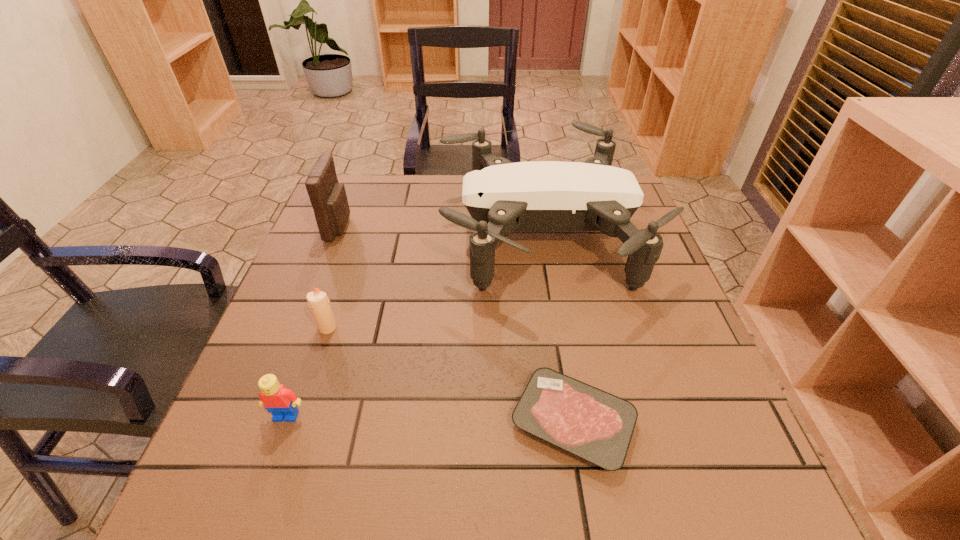
I want to click on vacant space located 0.100m on the face of the Lego, so click(x=263, y=481).

The height and width of the screenshot is (540, 960). What are the coordinates of `free location located 0.320m on the back of the steak` in the screenshot? It's located at (547, 265).

Where is `drone at the far edge`? The image size is (960, 540). drone at the far edge is located at coordinates (501, 196).

I want to click on pouch that is at the far edge, so click(x=328, y=198).

Where is `object that is at the near edge`? The image size is (960, 540). object that is at the near edge is located at coordinates (597, 426).

Image resolution: width=960 pixels, height=540 pixels. Identify the location of pouch that is at the left edge. (328, 198).

Identify the location of candle at the left edge. (318, 301).

Identify the location of Lego located in the left edge section of the desktop. The image size is (960, 540). (281, 402).

You are a GUI agent. You are given a task and a screenshot of the screen. Output one action in this format:
    pyautogui.click(x=<x>, y=<y>)
    Task: Click on the object at the right edge
    Image resolution: width=960 pixels, height=540 pixels.
    Given the screenshot: What is the action you would take?
    pyautogui.click(x=501, y=196)

You are a GUI agent. You are given a task and a screenshot of the screen. Output one action in this format:
    pyautogui.click(x=<x>, y=<y>)
    Task: Click on the object that is at the far left corner
    The height and width of the screenshot is (540, 960).
    Given the screenshot: What is the action you would take?
    pyautogui.click(x=328, y=198)